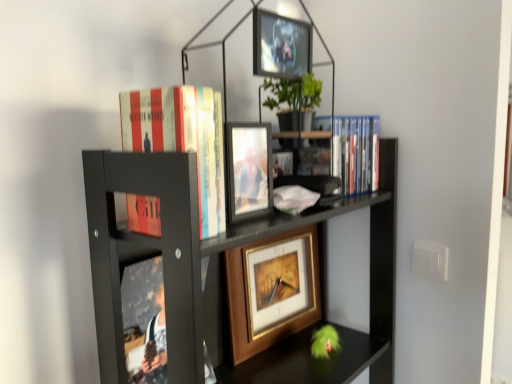
Find the location of a particular element. The width and height of the screenshot is (512, 384). black matte bookcase at upper center is located at coordinates (208, 253).

You are a GUI agent. You are given a task and a screenshot of the screen. Output one action in this format:
    pyautogui.click(x=<x>, y=<y>)
    Task: Click on the blue plastic dvds at upper right, marked as the first book in a right-to-left arrangement
    
    Given the screenshot: What is the action you would take?
    pyautogui.click(x=356, y=153)

I want to click on gold-framed picture at center, which is counted as the 1th picture frame, starting from the bottom, so click(272, 290).

In order to face matte glass photo frame at center, the second picture frame when ordered from top to bottom, should I rotate leftwards or rightwards?

Rotate left and turn 0.631 degrees.

Identify the location of hardcover book at upper center, the second book positioned from the back. (182, 139).

Does metallic silver picture frame at upper center, which is the 2th picture frame in back-to-front order, have a lesser height compared to hardcover book at upper center, which ranks as the 1th book in left-to-right order?

Correct, metallic silver picture frame at upper center, which is the 2th picture frame in back-to-front order, is not as tall as hardcover book at upper center, which ranks as the 1th book in left-to-right order.

Which is farther, (254,58) or (199,154)?

Point (254,58)

Consider the image. Would you consider metallic silver picture frame at upper center, which is counted as the 1th picture frame, starting from the top, to be distant from hardcover book at upper center, which is the 1th book in front-to-back order?

No.

Between black matte bookcase at upper center and blue plastic dvds at upper right, marked as the first book in a right-to-left arrangement, which one appears on the left side from the viewer's perspective?

black matte bookcase at upper center.

From a real-world perspective, is black matte bookcase at upper center on top of blue plastic dvds at upper right, which is the second book from left to right?

Actually, black matte bookcase at upper center is physically below blue plastic dvds at upper right, which is the second book from left to right, in the real world.

Is black matte bookcase at upper center looking in the opposite direction of blue plastic dvds at upper right, placed as the second book when sorted from front to back?

No, black matte bookcase at upper center is not facing the opposite direction of blue plastic dvds at upper right, placed as the second book when sorted from front to back.

Are black matte bookcase at upper center and blue plastic dvds at upper right, placed as the first book when sorted from back to front, far apart?

They are positioned close to each other.

Which of these two, blue plastic dvds at upper right, placed as the first book when sorted from back to front, or metallic silver picture frame at upper center, which is counted as the 1th picture frame, starting from the top, stands shorter?

Standing shorter between the two is metallic silver picture frame at upper center, which is counted as the 1th picture frame, starting from the top.

In terms of width, does blue plastic dvds at upper right, which is the second book from left to right, look wider or thinner when compared to metallic silver picture frame at upper center, which is the third picture frame in bottom-to-top order?

In the image, blue plastic dvds at upper right, which is the second book from left to right, appears to be wider than metallic silver picture frame at upper center, which is the third picture frame in bottom-to-top order.

Is blue plastic dvds at upper right, placed as the first book when sorted from back to front, touching metallic silver picture frame at upper center, which is the 2th picture frame in back-to-front order?

No.

Consider the image. Is hardcover book at upper center, the 2th book viewed from the right, taller or shorter than metallic silver picture frame at upper center, which is the third picture frame in bottom-to-top order?

Considering their sizes, hardcover book at upper center, the 2th book viewed from the right, has more height than metallic silver picture frame at upper center, which is the third picture frame in bottom-to-top order.

Based on the photo, which object is positioned more to the left, hardcover book at upper center, which is the 1th book in front-to-back order, or metallic silver picture frame at upper center, which is the 2th picture frame in back-to-front order?

hardcover book at upper center, which is the 1th book in front-to-back order.

Is hardcover book at upper center, the second book positioned from the back, inside the boundaries of metallic silver picture frame at upper center, which is the 2th picture frame from front to back, or outside?

hardcover book at upper center, the second book positioned from the back, is spatially situated outside metallic silver picture frame at upper center, which is the 2th picture frame from front to back.

Can you confirm if hardcover book at upper center, the second book positioned from the back, is wider than metallic silver picture frame at upper center, which is the third picture frame in bottom-to-top order?

Indeed, hardcover book at upper center, the second book positioned from the back, has a greater width compared to metallic silver picture frame at upper center, which is the third picture frame in bottom-to-top order.

Can you tell me how much metallic silver picture frame at upper center, which is the 2th picture frame from front to back, and matte glass photo frame at center, which is the 1th picture frame in front-to-back order, differ in facing direction?

The angular difference between metallic silver picture frame at upper center, which is the 2th picture frame from front to back, and matte glass photo frame at center, which is the 1th picture frame in front-to-back order, is 5.09e-05 degrees.

Considering the relative positions of metallic silver picture frame at upper center, which is the third picture frame in bottom-to-top order, and matte glass photo frame at center, the second picture frame when ordered from top to bottom, in the image provided, is metallic silver picture frame at upper center, which is the third picture frame in bottom-to-top order, to the left of matte glass photo frame at center, the second picture frame when ordered from top to bottom, from the viewer's perspective?

Incorrect, metallic silver picture frame at upper center, which is the third picture frame in bottom-to-top order, is not on the left side of matte glass photo frame at center, the second picture frame when ordered from top to bottom.

Is metallic silver picture frame at upper center, which is the third picture frame in bottom-to-top order, outside of matte glass photo frame at center, the second picture frame when ordered from bottom to top?

Yes, metallic silver picture frame at upper center, which is the third picture frame in bottom-to-top order, is outside of matte glass photo frame at center, the second picture frame when ordered from bottom to top.

Considering the positions of points (265, 208) and (382, 236), is point (265, 208) closer to camera compared to point (382, 236)?

Yes.

Looking at their sizes, would you say matte glass photo frame at center, the second picture frame when ordered from top to bottom, is wider or thinner than black matte bookcase at upper center?

matte glass photo frame at center, the second picture frame when ordered from top to bottom, is thinner than black matte bookcase at upper center.

Identify the location of bookcase in front of the matte glass photo frame at center, which is the 1th picture frame in front-to-back order. This screenshot has height=384, width=512. (208, 253).

From a real-world perspective, is matte glass photo frame at center, the second picture frame when ordered from top to bottom, physically located above or below black matte bookcase at upper center?

matte glass photo frame at center, the second picture frame when ordered from top to bottom, is above black matte bookcase at upper center.

Could you tell me if gold-framed picture at center, which is counted as the 1th picture frame, starting from the bottom, is facing black matte bookcase at upper center?

Yes, gold-framed picture at center, which is counted as the 1th picture frame, starting from the bottom, is oriented towards black matte bookcase at upper center.

Considering the sizes of objects gold-framed picture at center, which is counted as the 1th picture frame, starting from the bottom, and black matte bookcase at upper center in the image provided, who is shorter, gold-framed picture at center, which is counted as the 1th picture frame, starting from the bottom, or black matte bookcase at upper center?

With less height is gold-framed picture at center, which is counted as the 1th picture frame, starting from the bottom.

Which object is positioned more to the right, gold-framed picture at center, the 3th picture frame in the front-to-back sequence, or black matte bookcase at upper center?

Positioned to the right is gold-framed picture at center, the 3th picture frame in the front-to-back sequence.

How far apart are gold-framed picture at center, acting as the 3th picture frame starting from the top, and black matte bookcase at upper center?

gold-framed picture at center, acting as the 3th picture frame starting from the top, and black matte bookcase at upper center are 5.35 inches apart.

Find the location of a particular element. the 2nd book positioned below the metallic silver picture frame at upper center, which is the 2th picture frame in back-to-front order (from the image's perspective) is located at coordinates (182, 139).

Which book is the 2nd one when counting from the back of the black matte bookcase at upper center? Please provide its 2D coordinates.

[(356, 153)]

Based on the photo, based on their spatial positions, is hardcover book at upper center, the 2th book viewed from the right, or metallic silver picture frame at upper center, which is the 2th picture frame in back-to-front order, further from gold-framed picture at center, the 3th picture frame in the front-to-back sequence?

metallic silver picture frame at upper center, which is the 2th picture frame in back-to-front order.

From the image, which object appears to be farther from black matte bookcase at upper center, gold-framed picture at center, acting as the 3th picture frame starting from the top, or metallic silver picture frame at upper center, which is the third picture frame in bottom-to-top order?

metallic silver picture frame at upper center, which is the third picture frame in bottom-to-top order, is positioned further to the anchor black matte bookcase at upper center.

Looking at this image, looking at the image, which one is located closer to black matte bookcase at upper center, hardcover book at upper center, which is the 1th book in front-to-back order, or blue plastic dvds at upper right, which is the second book from left to right?

Among the two, hardcover book at upper center, which is the 1th book in front-to-back order, is located nearer to black matte bookcase at upper center.

Estimate the real-world distances between objects in this image. Which object is further from gold-framed picture at center, the 3th picture frame in the front-to-back sequence, metallic silver picture frame at upper center, which is the 2th picture frame in back-to-front order, or hardcover book at upper center, the 2th book viewed from the right?

Based on the image, metallic silver picture frame at upper center, which is the 2th picture frame in back-to-front order, appears to be further to gold-framed picture at center, the 3th picture frame in the front-to-back sequence.

When comparing their distances from black matte bookcase at upper center, does matte glass photo frame at center, the second picture frame when ordered from bottom to top, or gold-framed picture at center, marked as the 1th picture frame in a back-to-front arrangement, seem closer?

gold-framed picture at center, marked as the 1th picture frame in a back-to-front arrangement, is closer to black matte bookcase at upper center.

When comparing their distances from matte glass photo frame at center, the second picture frame when ordered from bottom to top, does black matte bookcase at upper center or metallic silver picture frame at upper center, which is the 2th picture frame from front to back, seem closer?

metallic silver picture frame at upper center, which is the 2th picture frame from front to back, lies closer to matte glass photo frame at center, the second picture frame when ordered from bottom to top, than the other object.

From the image, which object appears to be nearer to metallic silver picture frame at upper center, which is counted as the 1th picture frame, starting from the top, gold-framed picture at center, the 3th picture frame in the front-to-back sequence, or blue plastic dvds at upper right, which is the second book from left to right?

Based on the image, blue plastic dvds at upper right, which is the second book from left to right, appears to be nearer to metallic silver picture frame at upper center, which is counted as the 1th picture frame, starting from the top.

Which object lies further to the anchor point hardcover book at upper center, the second book positioned from the back, black matte bookcase at upper center or matte glass photo frame at center, which is the 1th picture frame in front-to-back order?

black matte bookcase at upper center.

In order to click on book located between hardcover book at upper center, the second book positioned from the back, and gold-framed picture at center, which is counted as the 1th picture frame, starting from the bottom, in the depth direction in this screenshot , I will do `click(356, 153)`.

Where is `picture frame between blue plastic dvds at upper right, placed as the first book when sorted from back to front, and gold-framed picture at center, which is counted as the 1th picture frame, starting from the bottom, vertically`? Image resolution: width=512 pixels, height=384 pixels. picture frame between blue plastic dvds at upper right, placed as the first book when sorted from back to front, and gold-framed picture at center, which is counted as the 1th picture frame, starting from the bottom, vertically is located at coordinates (248, 170).

Find the location of a particular element. The image size is (512, 384). book positioned between black matte bookcase at upper center and blue plastic dvds at upper right, marked as the first book in a right-to-left arrangement, from near to far is located at coordinates (182, 139).

Locate an element on the screen. picture frame between metallic silver picture frame at upper center, which is the third picture frame in bottom-to-top order, and gold-framed picture at center, marked as the 1th picture frame in a back-to-front arrangement, vertically is located at coordinates (248, 170).